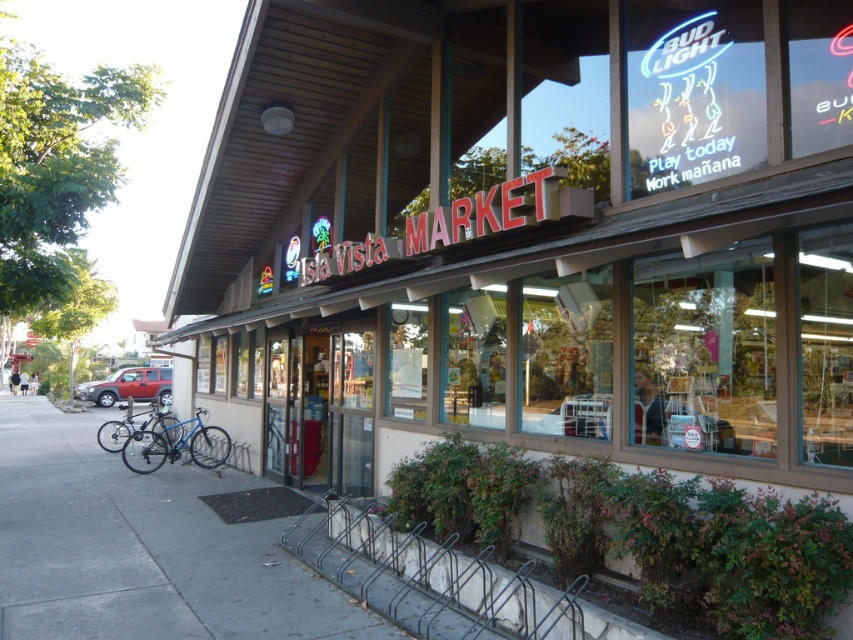
You are a customer arriving at the Isla Vista Market. You have a bike and a car to park. Where should you place each vehicle so they don not block the entrance? The gray concrete bike rack at lower center and the matte red suv at lower left are present.

The gray concrete bike rack at lower center is in front of the matte red suv at lower left. Therefore, you should park the bike at the gray concrete bike rack at lower center and position the car behind the bike rack so it doesn not block the entrance.

You are a delivery person trying to park your van next to the gray concrete bike rack at lower center. The matte red suv at lower left is blocking the path. Can you move your van to the parking spot behind the bike rack?

The gray concrete bike rack at lower center is above the matte red suv at lower left, meaning the bike rack is closer to you. Since the suv is behind the bike rack, it won not block the path to park behind the bike rack.

You are a delivery person standing on the gray concrete sidewalk at lower left and need to park your blue matte bicycle at lower left. Is there enough space to park the bicycle without blocking the sidewalk?

The gray concrete sidewalk at lower left might be wider than blue matte bicycle at lower left, so there is likely enough space to park the bicycle without blocking the sidewalk.